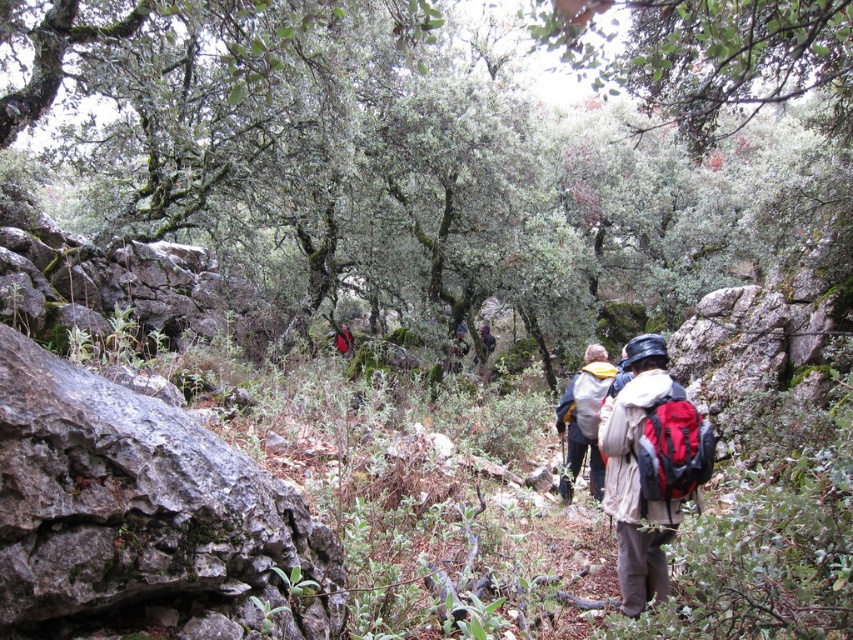
You are a hiker standing at the starting point of a trail. You see a white fabric backpack at center. Can you safely pick it up without moving more than 7 meters forward?

The white fabric backpack at center is 7.08 meters away from viewer, so you cannot safely pick it up without moving more than 7 meters forward.

You are a hiker trying to locate your red fabric backpack at center. You see a green mossy tree at center in the distance. According to the scene, which direction should you move to reach your backpack?

The green mossy tree at center is to the right of the red fabric backpack at center, so you should move to your left to reach the backpack.

In the scene shown: You are a hiker trying to locate your gear. You see a white fabric backpack at center and a red fabric backpack at center. Which backpack is closer to the ground?

The white fabric backpack at center is positioned under the red fabric backpack at center, so it is closer to the ground.